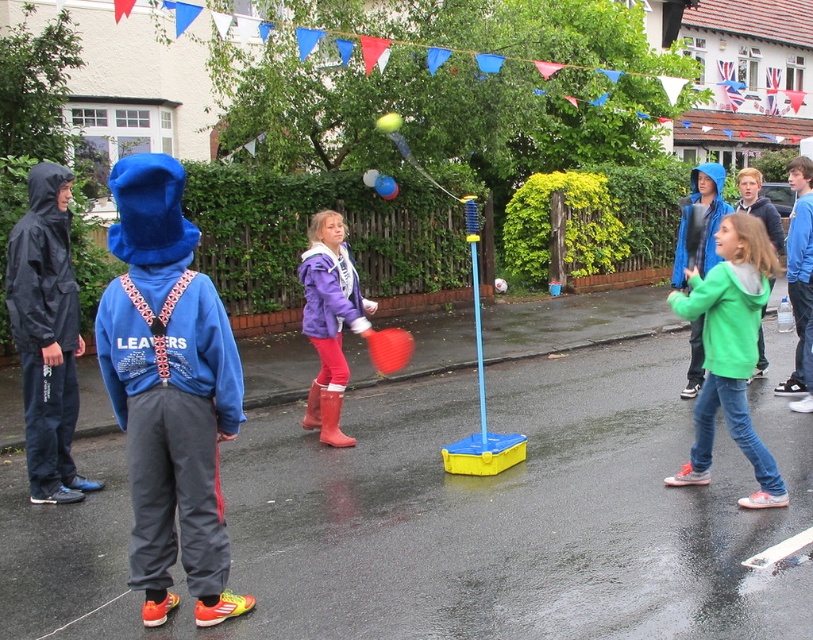
You are a delivery person who needs to leave a package for the resident at the house with the red, white, and blue bunting flags. You see the green fleece jacket at right in the scene. Where should you place the package so it is closest to the jacket without being under it?

Place the package near the green fleece jacket at right but not under it, perhaps to the side or slightly behind, ensuring it remains visible and accessible.

You are a photographer trying to capture a photo of the purple fleece jacket at center and the green fleece jacket at right. Based on their positions, which jacket should you focus on first to ensure both are in the frame?

The purple fleece jacket at center is to the left of the green fleece jacket at right, so you should focus on the purple fleece jacket at center first to ensure both are in the frame.